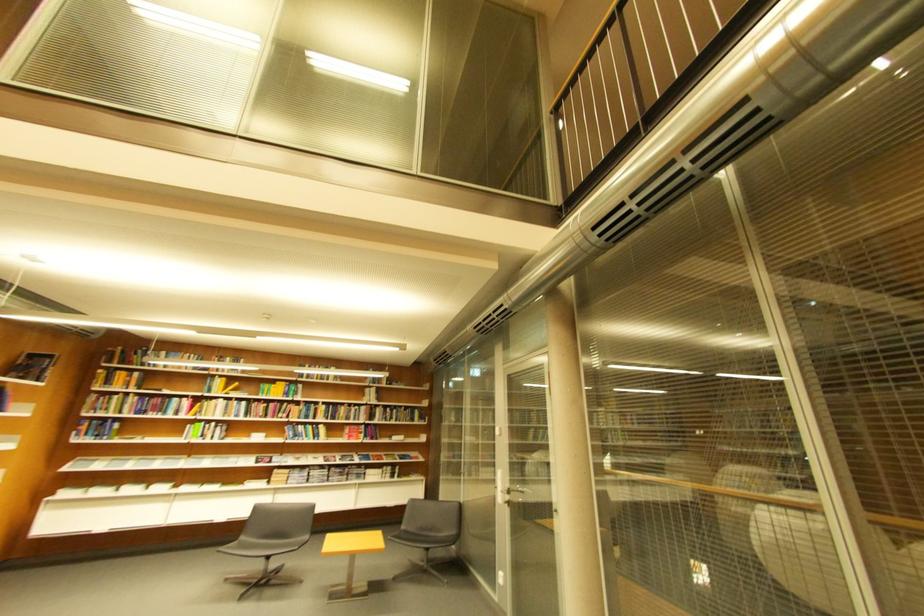
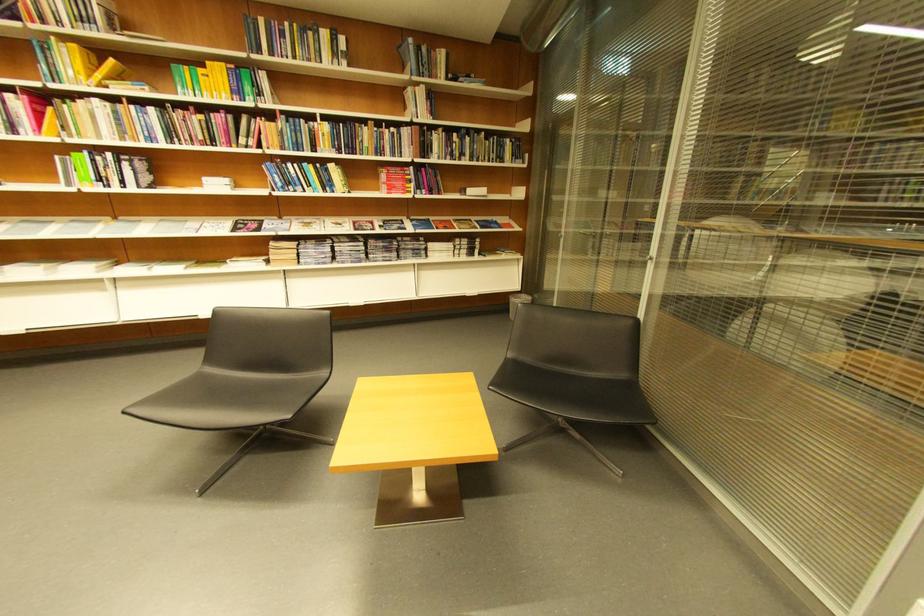
Find the pixel in the second image that matches pixel 232 400 in the first image.

(106, 102)